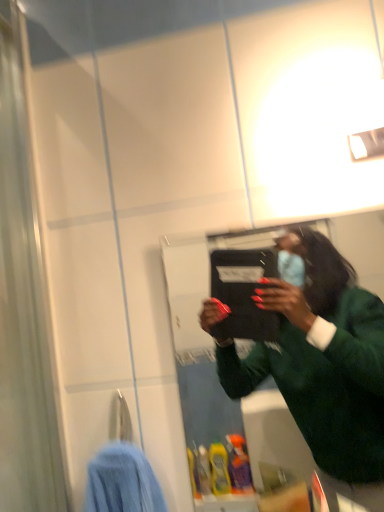
Describe the element at coordinates (323, 365) in the screenshot. The image size is (384, 512). I see `green fuzzy sweater at upper right` at that location.

What is the approximate height of green fuzzy sweater at upper right?

It is 40.11 centimeters.

I want to click on green fuzzy sweater at upper right, so click(323, 365).

What is the approximate width of green fuzzy sweater at upper right?

It is 1.24 inches.

Find the location of a particular element. Image resolution: width=384 pixels, height=512 pixels. green fuzzy sweater at upper right is located at coordinates (323, 365).